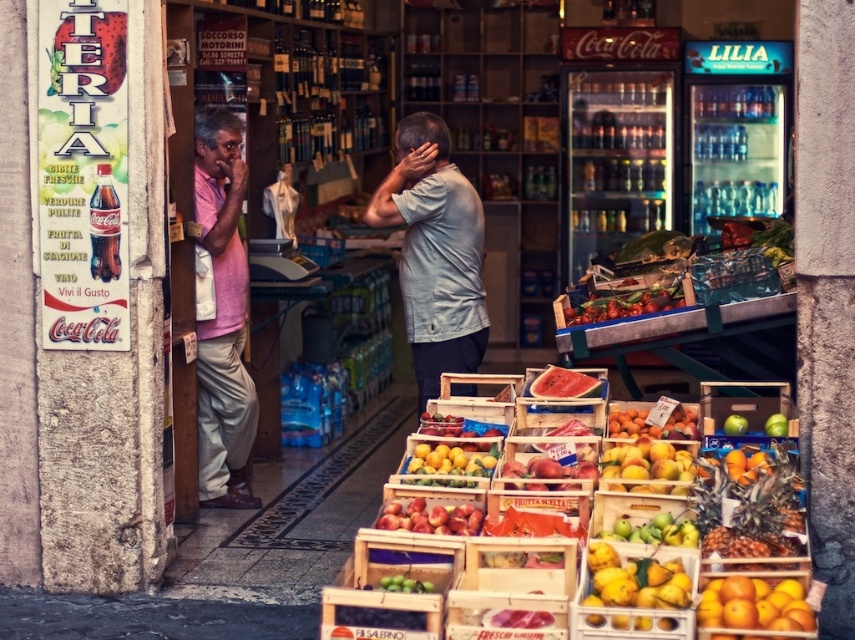
Question: Can you confirm if shiny red tomatoes at center is positioned below smooth pink watermelon at center?

Choices:
 (A) yes
 (B) no

Answer: (B)

Question: Does gray cotton shirt at center have a larger size compared to smooth pink watermelon at center?

Choices:
 (A) yes
 (B) no

Answer: (A)

Question: Does yellow matte pears at center come behind shiny red tomatoes at center?

Choices:
 (A) no
 (B) yes

Answer: (A)

Question: Which is farther from the yellow matte pears at center?

Choices:
 (A) orange matte fruit at lower right
 (B) gray cotton shirt at center

Answer: (B)

Question: Which point is farther to the camera?

Choices:
 (A) pink cotton shirt at left
 (B) yellow matte pears at center

Answer: (A)

Question: Which point is closer to the camera?

Choices:
 (A) (693, 525)
 (B) (214, 122)

Answer: (A)